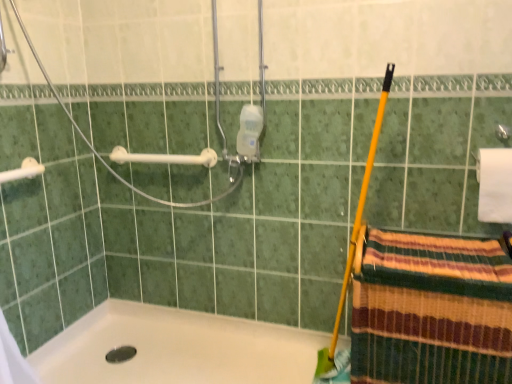
Question: Looking at the image, does striped woven towel at lower right seem bigger or smaller compared to white plastic towel bar at upper left, marked as the 1th towel bar in a front-to-back arrangement?

Choices:
 (A) big
 (B) small

Answer: (A)

Question: From a real-world perspective, is striped woven towel at lower right positioned above or below white plastic towel bar at upper left, which is counted as the 1th towel bar, starting from the left?

Choices:
 (A) below
 (B) above

Answer: (A)

Question: Which object is the farthest from the white plastic shower at upper left?

Choices:
 (A) white matte toilet paper at upper right
 (B) white plastic towel bar at upper left, the 1th towel bar in the right-to-left sequence
 (C) white glossy bathtub at lower left
 (D) white plastic towel bar at upper left, which is counted as the 1th towel bar, starting from the left
 (E) striped woven towel at lower right

Answer: (A)

Question: Estimate the real-world distances between objects in this image. Which object is farther from the white matte toilet paper at upper right?

Choices:
 (A) white glossy bathtub at lower left
 (B) white plastic towel bar at upper left, placed as the second towel bar when sorted from right to left
 (C) white plastic towel bar at upper left, the second towel bar viewed from the front
 (D) striped woven towel at lower right
 (E) white plastic shower at upper left

Answer: (B)